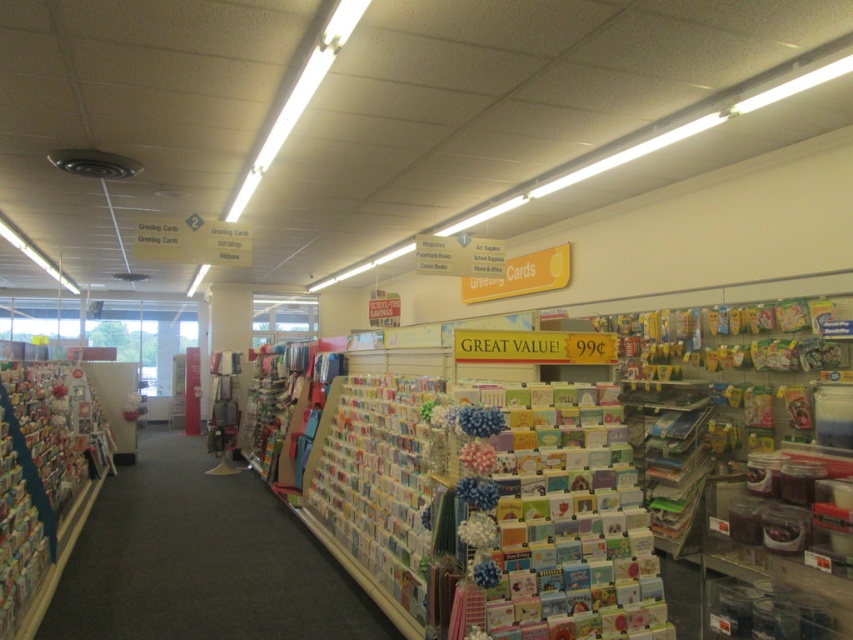
Does white paper greeting cards at center have a lesser height compared to cardboard greeting cards at left?

Indeed, white paper greeting cards at center has a lesser height compared to cardboard greeting cards at left.

Is white paper greeting cards at center taller than cardboard greeting cards at left?

In fact, white paper greeting cards at center may be shorter than cardboard greeting cards at left.

Locate an element on the screen. white paper greeting cards at center is located at coordinates (201, 561).

Image resolution: width=853 pixels, height=640 pixels. Find the location of `white paper greeting cards at center`. white paper greeting cards at center is located at coordinates (201, 561).